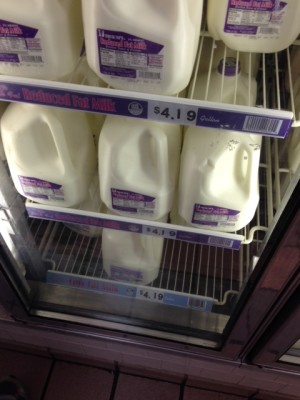
What are the coordinates of `squares on floor` in the screenshot? It's located at (24, 368), (73, 380), (147, 386), (190, 395).